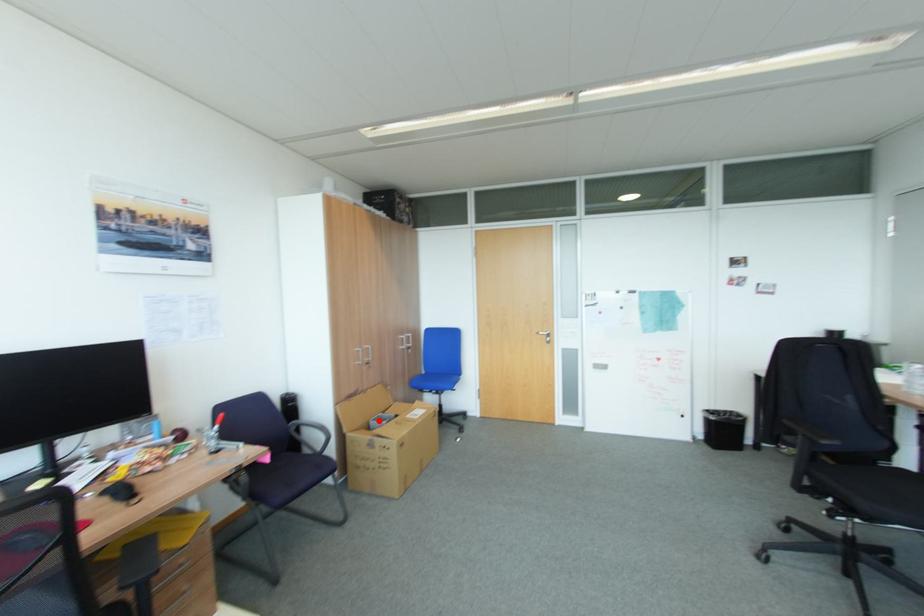
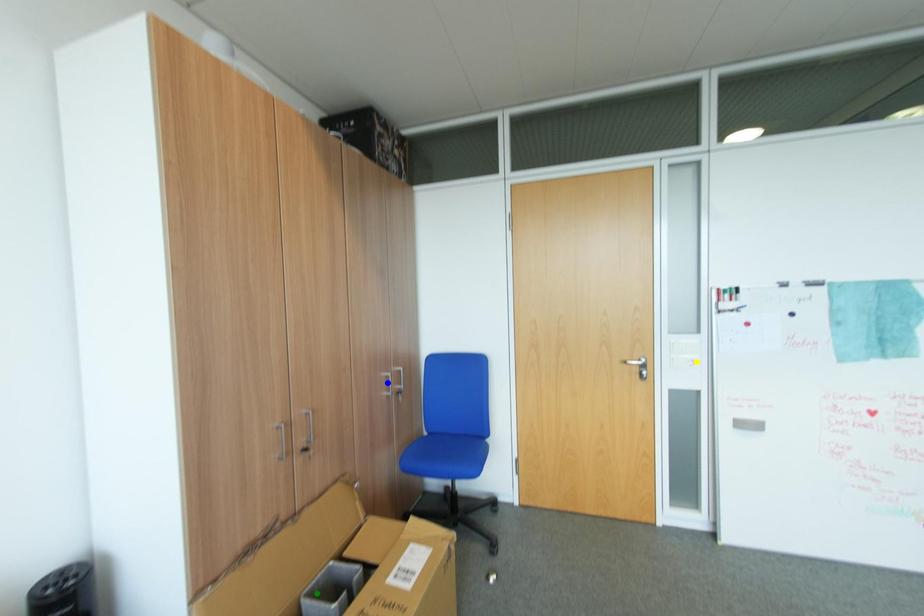
Question: I am providing you with two images of the same scene from different viewpoints. A red point is marked on the first image. You are given multiple points on the second image. Can you choose the point in image 2 that corresponds to the point in image 1?

Choices:
 (A) green point
 (B) yellow point
 (C) blue point

Answer: (A)